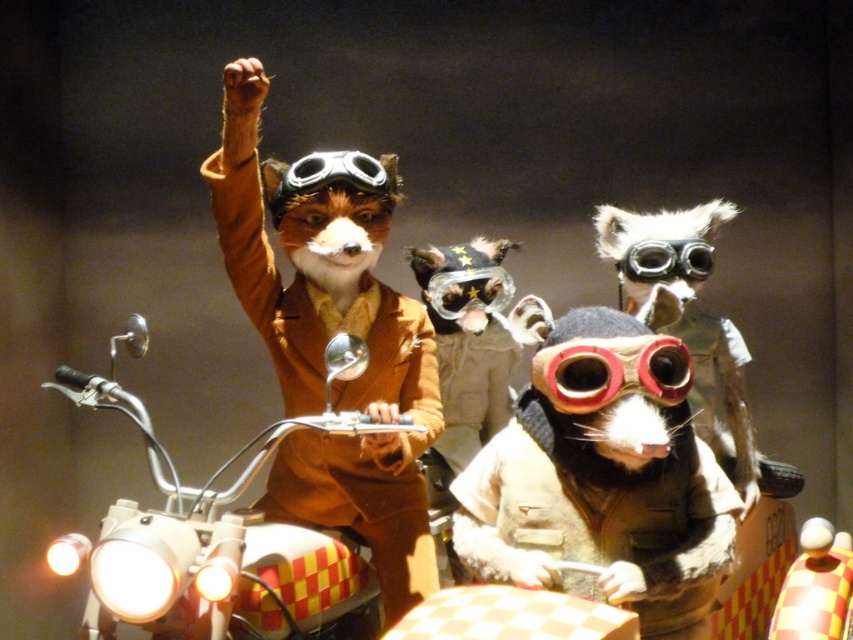
Can you confirm if fuzzy beige vest at center is thinner than shiny metallic goggles at center?

In fact, fuzzy beige vest at center might be wider than shiny metallic goggles at center.

Which is more to the left, fuzzy beige vest at center or shiny metallic goggles at center?

fuzzy beige vest at center

Is point (535, 486) positioned behind point (686, 244)?

No.

This screenshot has width=853, height=640. What are the coordinates of `fuzzy beige vest at center` in the screenshot? It's located at (602, 481).

Can you confirm if rubberized red goggles at center is thinner than shiny metallic goggles at center?

Incorrect, rubberized red goggles at center's width is not less than shiny metallic goggles at center's.

Does rubberized red goggles at center appear over shiny metallic goggles at center?

No, rubberized red goggles at center is not above shiny metallic goggles at center.

Where is `rubberized red goggles at center`? The width and height of the screenshot is (853, 640). rubberized red goggles at center is located at coordinates (611, 371).

The width and height of the screenshot is (853, 640). Identify the location of rubberized red goggles at center. (611, 371).

Consider the image. Between metallic chrome motorcycle at center and rubberized red goggles at center, which one is positioned higher?

rubberized red goggles at center is higher up.

Can you confirm if metallic chrome motorcycle at center is taller than rubberized red goggles at center?

Yes.

Is point (165, 481) behind point (541, 392)?

Yes, it is behind point (541, 392).

Locate an element on the screen. metallic chrome motorcycle at center is located at coordinates (212, 544).